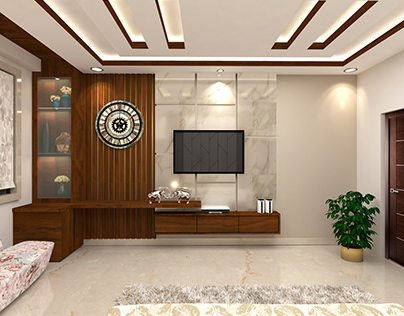
I want to click on glowing light, so click(x=174, y=183).